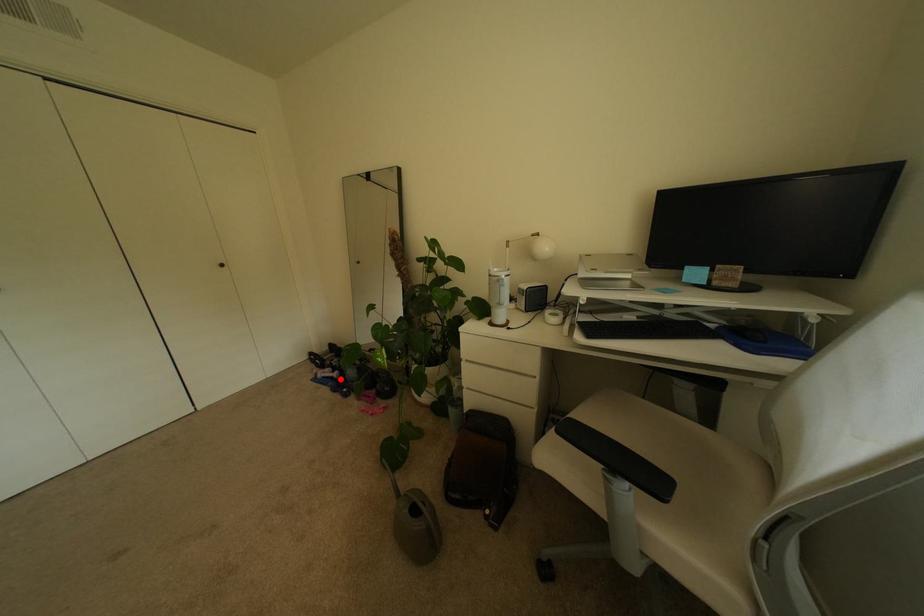
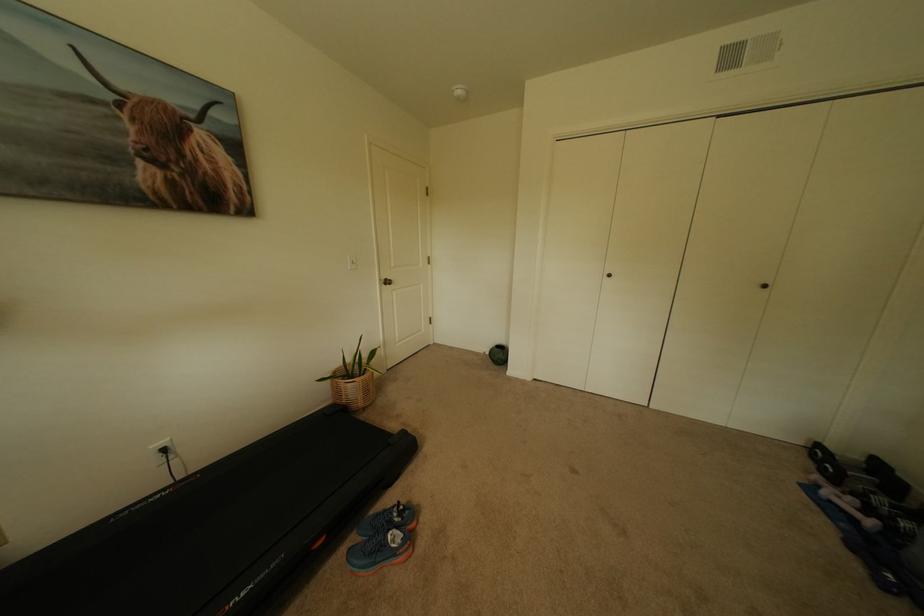
Question: I am providing you with two images of the same scene from different viewpoints. A red point is shown in image1. For the corresponding object point in image2, is it positioned nearer or farther from the camera?

Choices:
 (A) Nearer
 (B) Farther

Answer: (A)